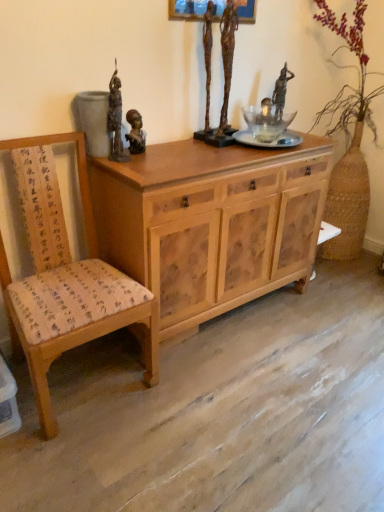
You are a GUI agent. You are given a task and a screenshot of the screen. Output one action in this format:
    pyautogui.click(x=<x>, y=<y>)
    Task: Click on the free spot in front of bronze statue at center, which ranks as the 1th sculpture in right-to-left order
    The height and width of the screenshot is (512, 384).
    Given the screenshot: What is the action you would take?
    pyautogui.click(x=231, y=154)